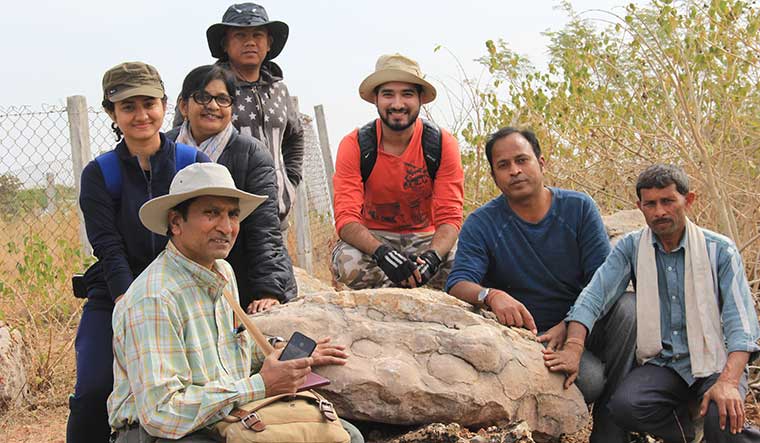
The height and width of the screenshot is (443, 760). What are the coordinates of `phone` in the screenshot? It's located at (301, 346).